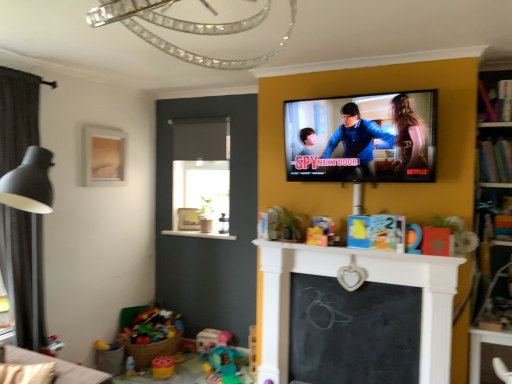
Question: Does bright multicolored plastic toys at lower left, which is the 3th toy in bottom-to-top order, have a greater height compared to wooden bookshelf at upper right, arranged as the 2th shelf when viewed from the top?

Choices:
 (A) yes
 (B) no

Answer: (A)

Question: Does bright multicolored plastic toys at lower left, the 3th toy viewed from the right, have a lesser width compared to wooden bookshelf at upper right, the first shelf in the bottom-to-top sequence?

Choices:
 (A) yes
 (B) no

Answer: (B)

Question: Considering the relative sizes of bright multicolored plastic toys at lower left, which is the 3th toy in bottom-to-top order, and wooden bookshelf at upper right, arranged as the 2th shelf when viewed from the top, in the image provided, is bright multicolored plastic toys at lower left, which is the 3th toy in bottom-to-top order, bigger than wooden bookshelf at upper right, arranged as the 2th shelf when viewed from the top,?

Choices:
 (A) yes
 (B) no

Answer: (A)

Question: Is bright multicolored plastic toys at lower left, the 2th toy positioned from the top, closer to the viewer compared to wooden bookshelf at upper right, the first shelf in the bottom-to-top sequence?

Choices:
 (A) yes
 (B) no

Answer: (B)

Question: Is bright multicolored plastic toys at lower left, the 2th toy in the left-to-right sequence, not within wooden bookshelf at upper right, arranged as the 2th shelf when viewed from the top?

Choices:
 (A) no
 (B) yes

Answer: (B)

Question: From the image's perspective, is wooden bookshelf at upper right, the first shelf in the bottom-to-top sequence, above or below translucent plastic cup at lower left, which is counted as the third toy, starting from the back?

Choices:
 (A) below
 (B) above

Answer: (B)

Question: Is point (481, 142) positioned closer to the camera than point (133, 360)?

Choices:
 (A) closer
 (B) farther

Answer: (A)

Question: Considering the positions of wooden bookshelf at upper right, arranged as the 2th shelf when viewed from the top, and translucent plastic cup at lower left, acting as the 1th toy starting from the left, in the image, is wooden bookshelf at upper right, arranged as the 2th shelf when viewed from the top, taller or shorter than translucent plastic cup at lower left, acting as the 1th toy starting from the left,?

Choices:
 (A) short
 (B) tall

Answer: (B)

Question: In the image, is wooden bookshelf at upper right, the first shelf in the bottom-to-top sequence, positioned in front of or behind translucent plastic cup at lower left, which is counted as the third toy, starting from the back?

Choices:
 (A) front
 (B) behind

Answer: (A)

Question: Is point (117, 160) closer or farther from the camera than point (33, 289)?

Choices:
 (A) farther
 (B) closer

Answer: (A)

Question: Is wooden frame at upper left, arranged as the 1th picture frame when viewed from the top, bigger or smaller than dark grey fabric curtain at left?

Choices:
 (A) big
 (B) small

Answer: (B)

Question: From their relative heights in the image, would you say wooden frame at upper left, the 2th picture frame from the right, is taller or shorter than dark grey fabric curtain at left?

Choices:
 (A) short
 (B) tall

Answer: (A)

Question: Considering the relative positions of wooden frame at upper left, which is the second picture frame from back to front, and dark grey fabric curtain at left in the image provided, is wooden frame at upper left, which is the second picture frame from back to front, to the left or to the right of dark grey fabric curtain at left?

Choices:
 (A) right
 (B) left

Answer: (A)

Question: Which is correct: black chalkboard at center is inside matte orange toy at center, the fourth toy viewed from the left, or outside of it?

Choices:
 (A) outside
 (B) inside

Answer: (A)

Question: Is point (296, 352) positioned closer to the camera than point (407, 225)?

Choices:
 (A) farther
 (B) closer

Answer: (A)